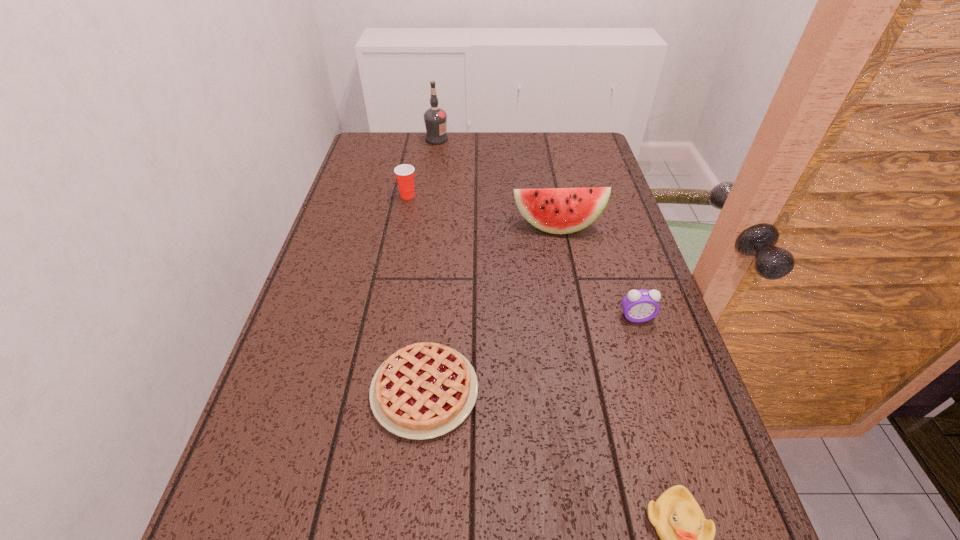
Find the location of a particular element. the farthest object is located at coordinates (435, 118).

Locate an element on the screen. Image resolution: width=960 pixels, height=540 pixels. vodka is located at coordinates (435, 118).

Image resolution: width=960 pixels, height=540 pixels. I want to click on watermelon, so click(554, 210).

What are the coordinates of `the fourth nearest object` in the screenshot? It's located at (554, 210).

The width and height of the screenshot is (960, 540). Find the location of `the second farthest object`. the second farthest object is located at coordinates (404, 173).

The width and height of the screenshot is (960, 540). Find the location of `alarm clock`. alarm clock is located at coordinates (639, 306).

Image resolution: width=960 pixels, height=540 pixels. I want to click on the shortest object, so click(422, 391).

This screenshot has width=960, height=540. I want to click on the second nearest object, so click(422, 391).

Image resolution: width=960 pixels, height=540 pixels. In order to click on vacant space located 0.230m on the front label of the vodka in this screenshot , I will do `click(514, 139)`.

Locate an element on the screen. vacant space located 0.090m on the outer rind of the fourth nearest object is located at coordinates (564, 261).